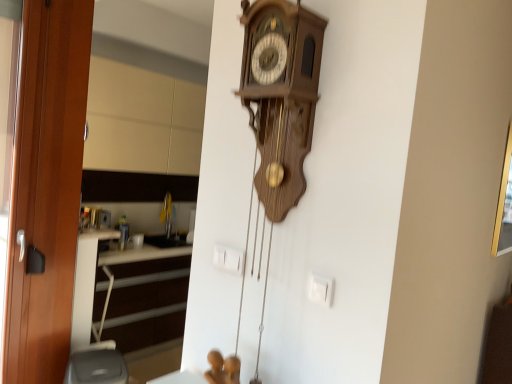
Where is `free space above wooden door at left (from a real-world perspective)`? free space above wooden door at left (from a real-world perspective) is located at coordinates (57, 16).